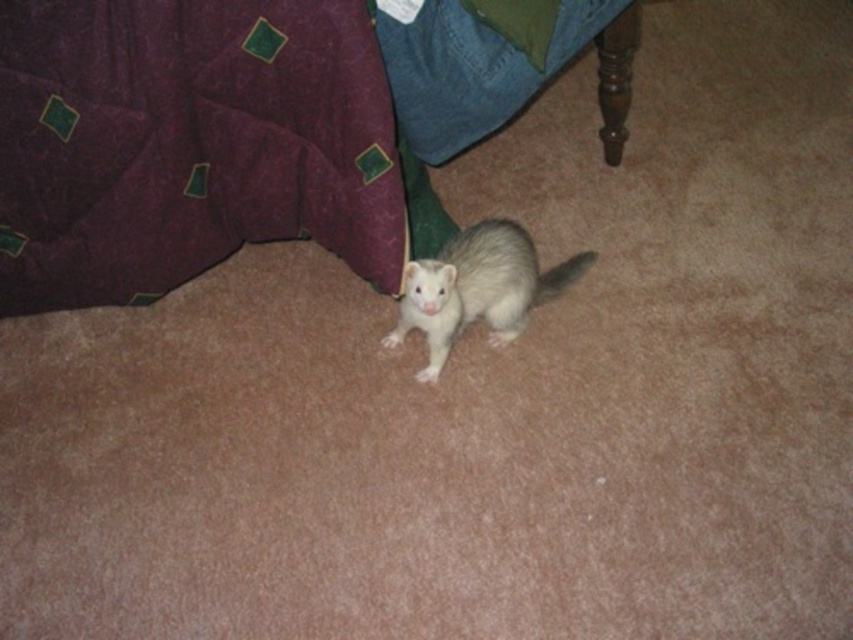
Question: Is white fur ferret at center thinner than white fur tail at center?

Choices:
 (A) no
 (B) yes

Answer: (A)

Question: Which point appears farthest from the camera in this image?

Choices:
 (A) (534, 300)
 (B) (526, 232)

Answer: (B)

Question: In this image, where is white fur ferret at center located relative to white fur tail at center?

Choices:
 (A) right
 (B) left

Answer: (B)

Question: In this image, where is white fur ferret at center located relative to white fur tail at center?

Choices:
 (A) left
 (B) right

Answer: (A)

Question: Which point appears farthest from the camera in this image?

Choices:
 (A) (489, 316)
 (B) (550, 289)

Answer: (B)